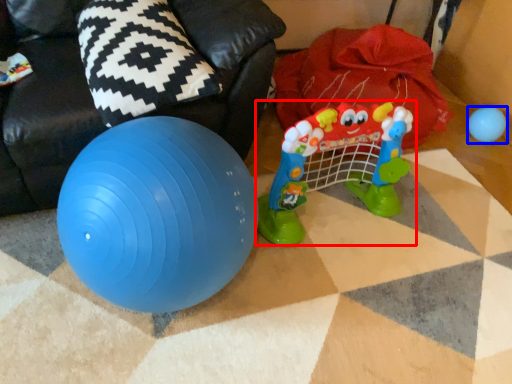
Question: Which object is further to the camera taking this photo, toy (highlighted by a red box) or toy (highlighted by a blue box)?

Choices:
 (A) toy
 (B) toy

Answer: (B)